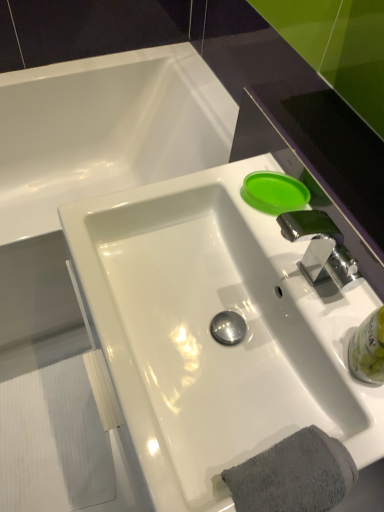
Question: Is clear plastic bottle at lower right, placed as the second liquid when sorted from left to right, placed right next to green matte lid at upper right, which appears as the 1th liquid when viewed from the back?

Choices:
 (A) no
 (B) yes

Answer: (A)

Question: Does clear plastic bottle at lower right, the 1th liquid viewed from the front, have a lesser width compared to green matte lid at upper right, which is counted as the second liquid, starting from the right?

Choices:
 (A) no
 (B) yes

Answer: (B)

Question: Can you confirm if clear plastic bottle at lower right, which is the second liquid in top-to-bottom order, is wider than green matte lid at upper right, which is counted as the second liquid, starting from the right?

Choices:
 (A) no
 (B) yes

Answer: (A)

Question: Can you confirm if clear plastic bottle at lower right, the 1th liquid viewed from the front, is smaller than green matte lid at upper right, which is counted as the second liquid, starting from the bottom?

Choices:
 (A) no
 (B) yes

Answer: (A)

Question: Can you confirm if clear plastic bottle at lower right, which is the second liquid in top-to-bottom order, is taller than green matte lid at upper right, positioned as the 1th liquid in top-to-bottom order?

Choices:
 (A) yes
 (B) no

Answer: (A)

Question: Is point (157, 445) positioned closer to the camera than point (271, 210)?

Choices:
 (A) closer
 (B) farther

Answer: (A)

Question: Considering the positions of white glossy sink at center and green matte lid at upper right, the first liquid in the left-to-right sequence, in the image, is white glossy sink at center taller or shorter than green matte lid at upper right, the first liquid in the left-to-right sequence,?

Choices:
 (A) short
 (B) tall

Answer: (B)

Question: Is white glossy sink at center spatially inside green matte lid at upper right, the first liquid in the left-to-right sequence, or outside of it?

Choices:
 (A) outside
 (B) inside

Answer: (A)

Question: Is white glossy sink at center in front of or behind green matte lid at upper right, positioned as the 1th liquid in top-to-bottom order, in the image?

Choices:
 (A) behind
 (B) front

Answer: (B)

Question: Do you think green matte lid at upper right, the 2th liquid positioned from the front, is within white glossy sink at center, or outside of it?

Choices:
 (A) inside
 (B) outside

Answer: (B)

Question: Relative to white glossy sink at center, is green matte lid at upper right, positioned as the 1th liquid in top-to-bottom order, in front or behind?

Choices:
 (A) behind
 (B) front

Answer: (A)

Question: From the image's perspective, is green matte lid at upper right, which is counted as the second liquid, starting from the right, positioned above or below white glossy sink at center?

Choices:
 (A) above
 (B) below

Answer: (A)

Question: Is green matte lid at upper right, which appears as the 1th liquid when viewed from the back, to the left or to the right of white glossy sink at center in the image?

Choices:
 (A) right
 (B) left

Answer: (A)

Question: Relative to clear plastic bottle at lower right, the 1th liquid from the right, is gray cotton towel at lower right in front or behind?

Choices:
 (A) behind
 (B) front

Answer: (B)

Question: Is gray cotton towel at lower right situated inside clear plastic bottle at lower right, the 1th liquid from the right, or outside?

Choices:
 (A) outside
 (B) inside

Answer: (A)